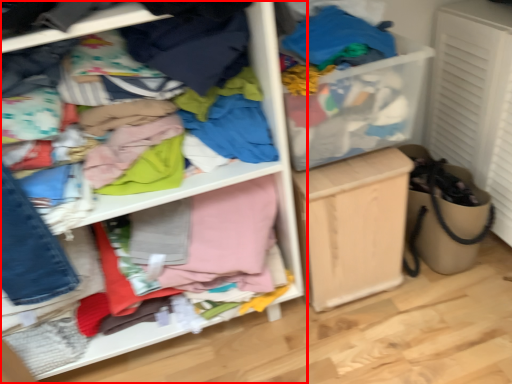
Question: Observing the image, what is the correct spatial positioning of shelf (annotated by the red box) in reference to cabinetry?

Choices:
 (A) left
 (B) right

Answer: (A)